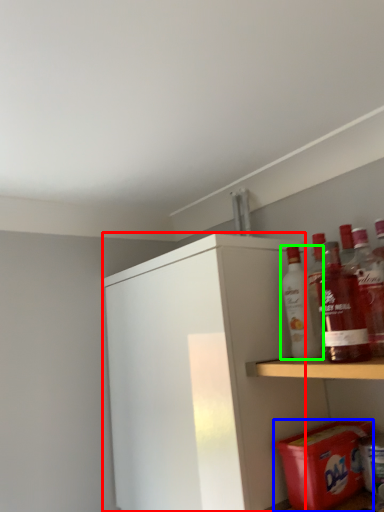
Question: Which object is positioned farthest from cabinetry (highlighted by a red box)? Select from carton (highlighted by a blue box) and bottle (highlighted by a green box).

Choices:
 (A) carton
 (B) bottle

Answer: (A)